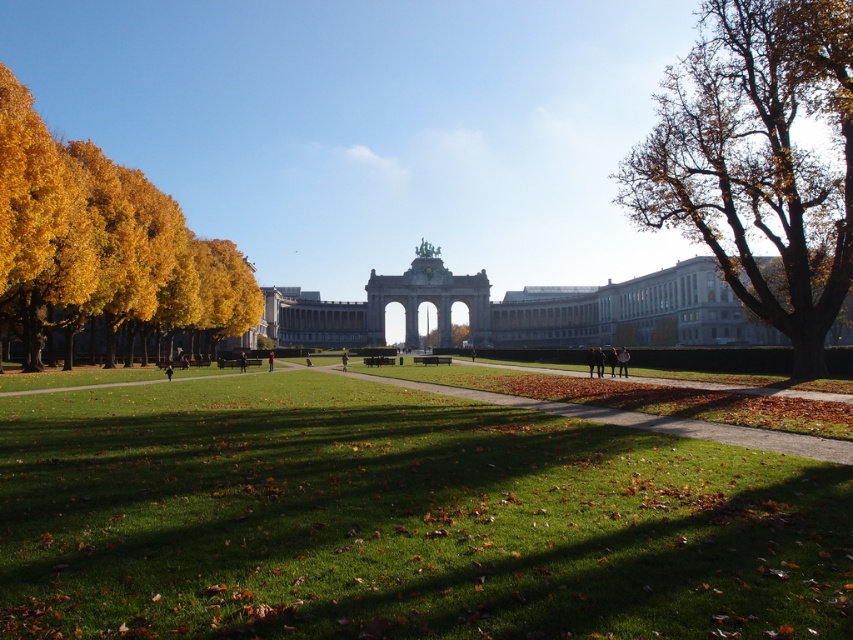
Is point (653, 227) closer to viewer compared to point (71, 141)?

Yes, it is in front of point (71, 141).

Does brown leafy tree at right appear over yellow leaves at left?

Indeed, brown leafy tree at right is positioned over yellow leaves at left.

Who is more forward, (827, 125) or (28, 225)?

Point (28, 225)

Where is `brown leafy tree at right`? This screenshot has height=640, width=853. brown leafy tree at right is located at coordinates (758, 161).

Which of these two, brown leafy tree at right or green leafy tree at center, stands shorter?

green leafy tree at center

Is brown leafy tree at right shorter than green leafy tree at center?

In fact, brown leafy tree at right may be taller than green leafy tree at center.

This screenshot has width=853, height=640. I want to click on brown leafy tree at right, so click(x=758, y=161).

Who is shorter, green grassy field at center or brown leafy tree at right?

Standing shorter between the two is green grassy field at center.

The image size is (853, 640). Describe the element at coordinates (399, 518) in the screenshot. I see `green grassy field at center` at that location.

Locate an element on the screen. The image size is (853, 640). green grassy field at center is located at coordinates (399, 518).